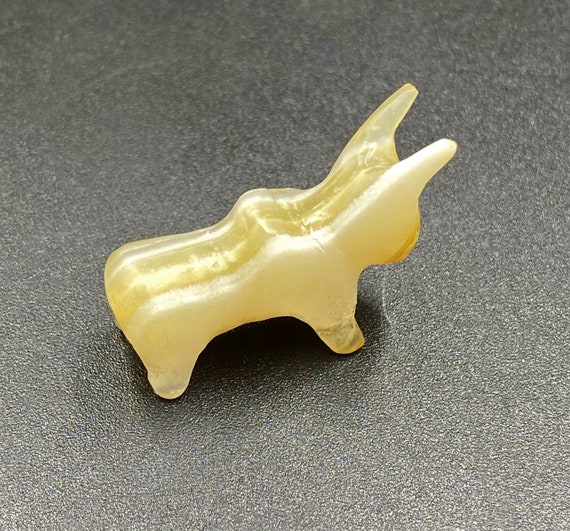
Identify the location of shadow beneath object. The image size is (570, 531). (250, 346), (366, 314), (135, 379), (260, 399).